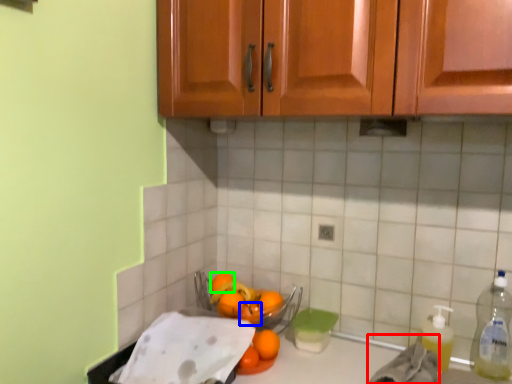
Question: Which object is the farthest from material (highlighted by a red box)? Choose among these: orange (highlighted by a blue box) or orange (highlighted by a green box).

Choices:
 (A) orange
 (B) orange

Answer: (B)